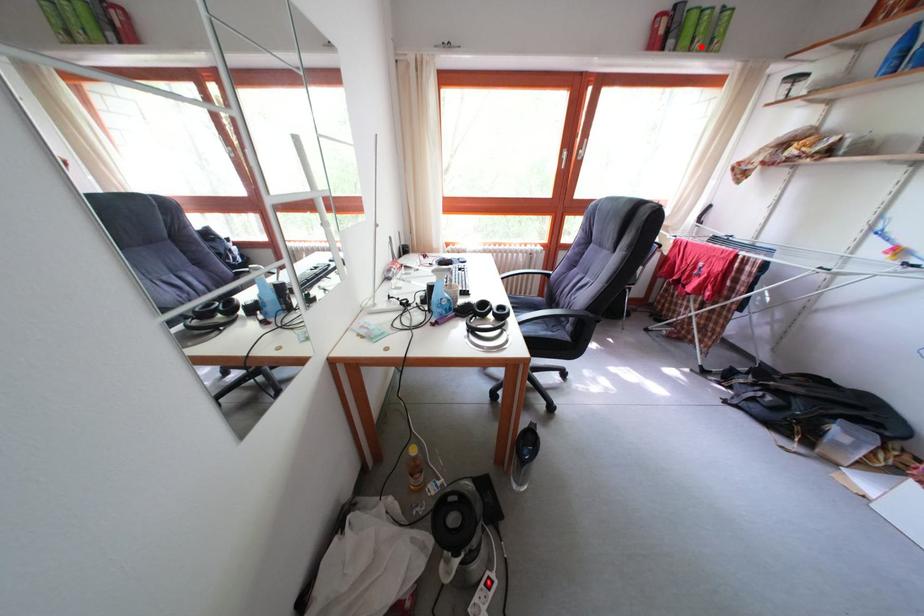
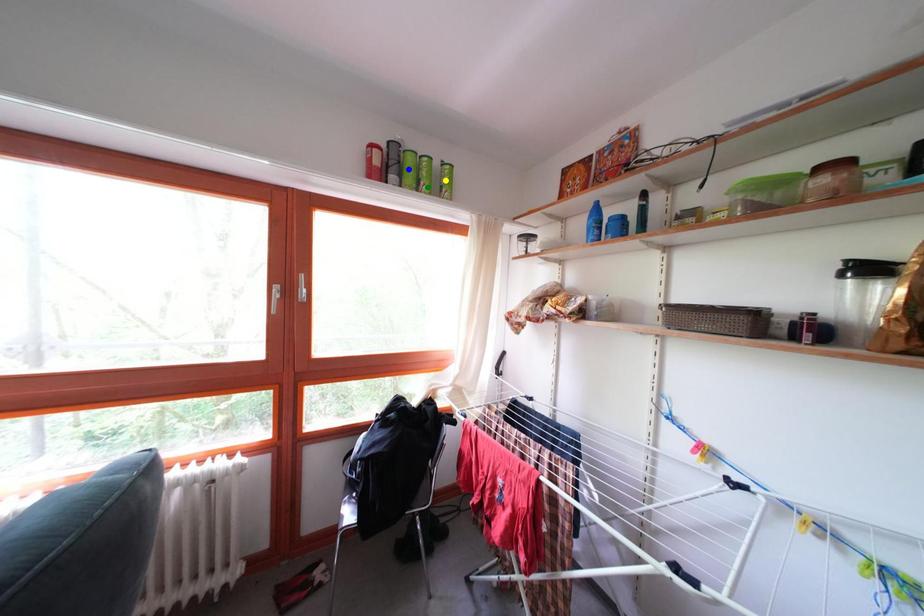
Question: I am providing you with two images of the same scene from different viewpoints. A red point is marked on the first image. You are given multiple points on the second image. Can you choose the point in image 2 that corresponds to the point in image 1?

Choices:
 (A) green point
 (B) blue point
 (C) yellow point

Answer: (A)